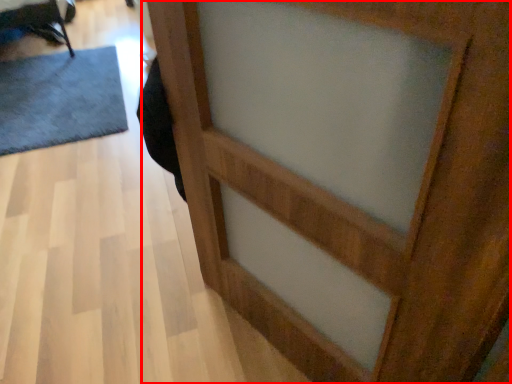
Question: Considering the relative positions of barn door (annotated by the red box) and doormat in the image provided, where is barn door (annotated by the red box) located with respect to the staircase?

Choices:
 (A) left
 (B) right

Answer: (B)